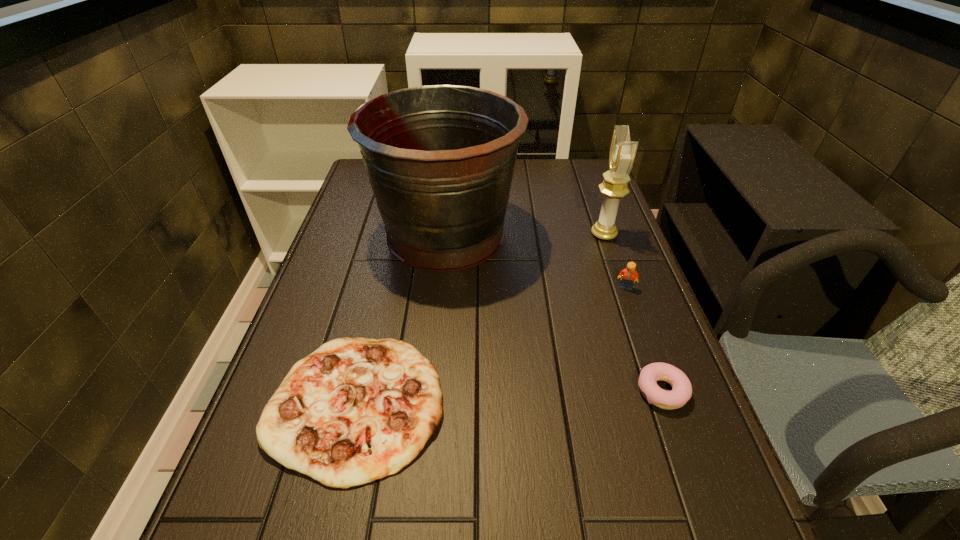
Where is `vacant space located on the back of the pizza`? The image size is (960, 540). vacant space located on the back of the pizza is located at coordinates click(x=378, y=313).

Find the location of a particular element. vacant space located on the left of the doughnut is located at coordinates (436, 392).

You are a GUI agent. You are given a task and a screenshot of the screen. Output one action in this format:
    pyautogui.click(x=<x>, y=<y>)
    Task: Click on the bucket that is at the left edge
    
    Given the screenshot: What is the action you would take?
    pyautogui.click(x=440, y=159)

The image size is (960, 540). Find the location of `pizza located in the left edge section of the desktop`. pizza located in the left edge section of the desktop is located at coordinates (355, 410).

In order to click on award that is at the right edge in this screenshot , I will do `click(622, 153)`.

At what (x,y) coordinates should I click in order to perform the action: click on Lego that is positioned at the right edge. Please return your answer as a coordinate pair (x, y). Looking at the image, I should click on (627, 275).

This screenshot has height=540, width=960. In order to click on doughnut present at the right edge in this screenshot , I will do tap(681, 392).

This screenshot has height=540, width=960. Identify the location of vacant space at the far edge. (532, 171).

Locate an element on the screen. free space at the left edge of the desktop is located at coordinates (361, 234).

This screenshot has width=960, height=540. In the image, there is a desktop. In order to click on vacant space at the right edge in this screenshot , I will do 620,237.